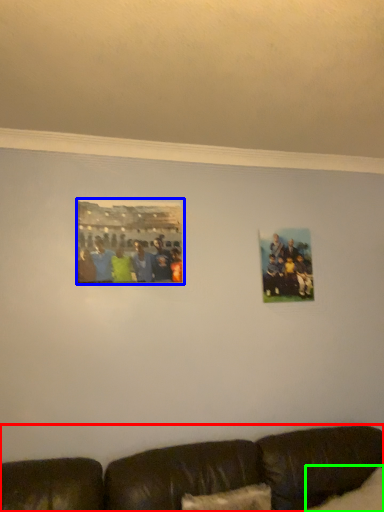
Question: Estimate the real-world distances between objects in this image. Which object is farther from studio couch (highlighted by a red box), picture frame (highlighted by a blue box) or pillow (highlighted by a green box)?

Choices:
 (A) picture frame
 (B) pillow

Answer: (A)